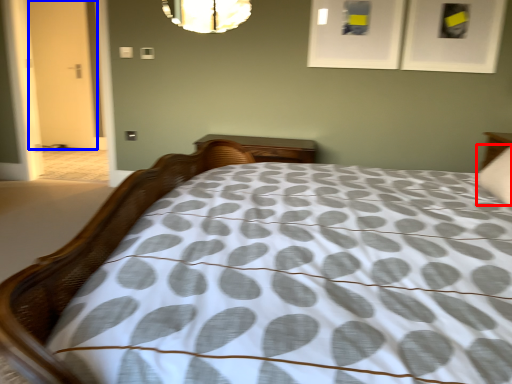
Question: Which point is closer to the camera, pillow (highlighted by a red box) or door (highlighted by a blue box)?

Choices:
 (A) pillow
 (B) door

Answer: (A)